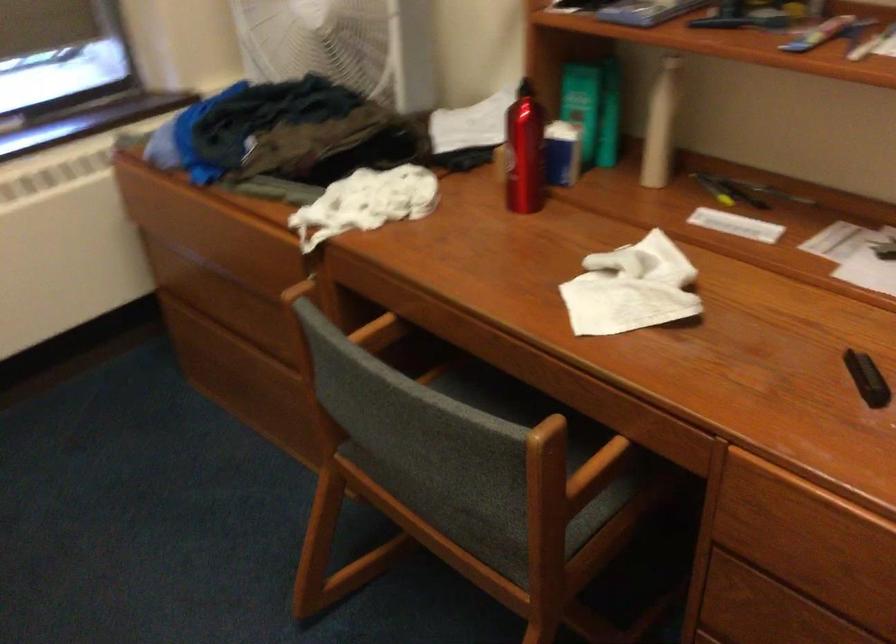
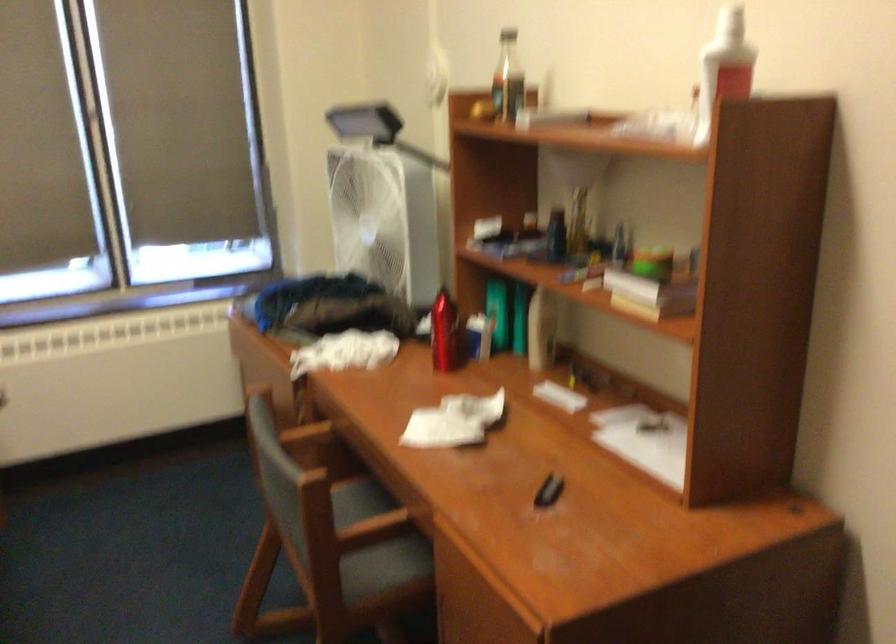
Where in the second image is the point corresponding to point 533,153 from the first image?

(444, 333)